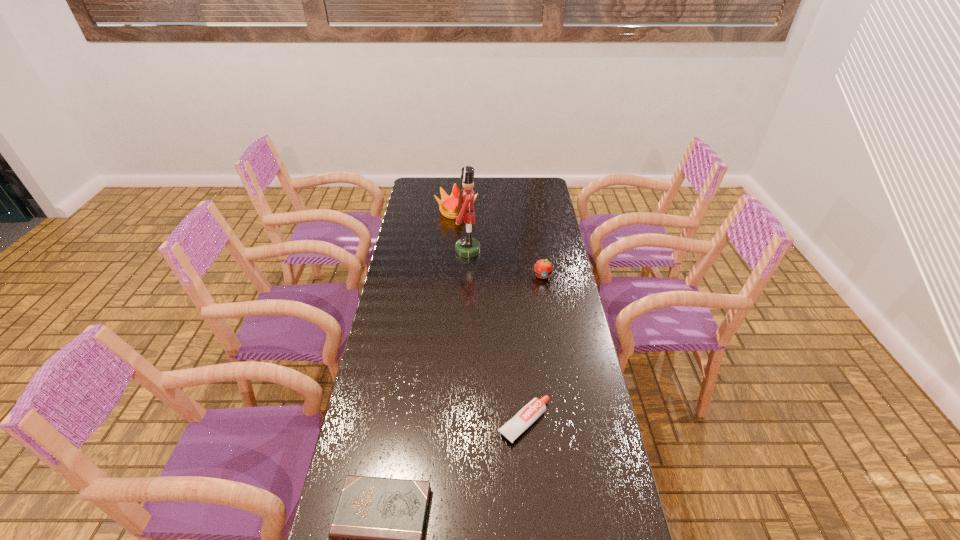
Identify the location of free space that satisfies the following two spatial constraints: 1. on the back side of the third nearest object; 2. on the front-facing side of the nutcracker. (538, 251).

I want to click on vacant region that satisfies the following two spatial constraints: 1. on the front-facing side of the apple; 2. on the left side of the nutcracker, so click(x=468, y=275).

What are the coordinates of `free space that satisfies the following two spatial constraints: 1. on the back side of the second nearest object; 2. on the front-facing side of the nutcracker` in the screenshot? It's located at (510, 251).

The image size is (960, 540). Find the location of `free spot that satisfies the following two spatial constraints: 1. on the front-facing side of the second farthest object; 2. on the back side of the third nearest object`. free spot that satisfies the following two spatial constraints: 1. on the front-facing side of the second farthest object; 2. on the back side of the third nearest object is located at coordinates (468, 275).